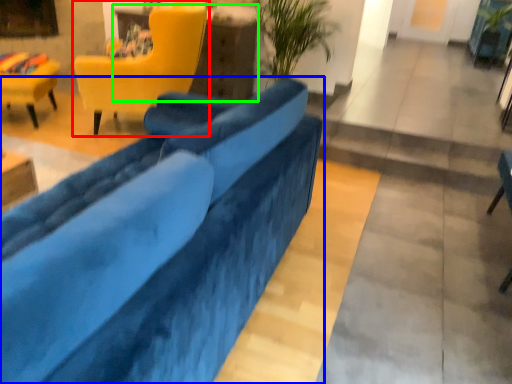
Question: Which object is positioned farthest from chair (highlighted by a red box)? Select from studio couch (highlighted by a blue box) and table (highlighted by a green box).

Choices:
 (A) studio couch
 (B) table

Answer: (A)